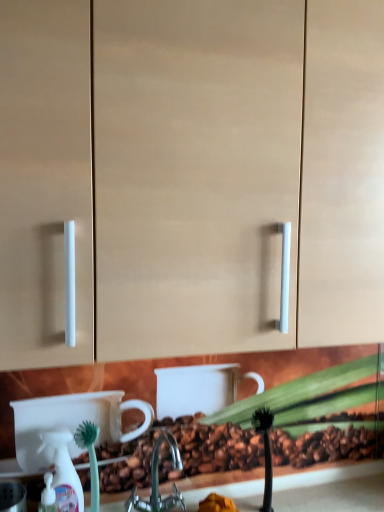
What do you see at coordinates (90, 457) in the screenshot? The width and height of the screenshot is (384, 512). I see `green bristle brush at lower left` at bounding box center [90, 457].

Image resolution: width=384 pixels, height=512 pixels. In order to click on metallic silver faucet at center in this screenshot , I will do `click(158, 480)`.

Identify the location of green bristle brush at lower left. (90, 457).

From the picture: Is green bristle brush at lower left behind white plastic spray bottle at lower left?

Yes, green bristle brush at lower left is further from the camera.

Is green bristle brush at lower left inside or outside of white plastic spray bottle at lower left?

green bristle brush at lower left exists outside the volume of white plastic spray bottle at lower left.

Considering the sizes of green bristle brush at lower left and white plastic spray bottle at lower left in the image, is green bristle brush at lower left wider or thinner than white plastic spray bottle at lower left?

Considering their sizes, green bristle brush at lower left looks broader than white plastic spray bottle at lower left.

From their relative heights in the image, would you say green bristle brush at lower left is taller or shorter than white plastic spray bottle at lower left?

In the image, green bristle brush at lower left appears to be taller than white plastic spray bottle at lower left.

At what (x,y) coordinates should I click in order to perform the action: click on plant on the left of matte beige cabinet at center. Please return your answer as a coordinate pair (x, y). Looking at the image, I should click on (90, 457).

Considering the relative sizes of matte beige cabinet at center and green bristle brush at lower left in the image provided, is matte beige cabinet at center taller than green bristle brush at lower left?

Correct, matte beige cabinet at center is much taller as green bristle brush at lower left.

Based on their positions, is matte beige cabinet at center located to the left or right of green bristle brush at lower left?

matte beige cabinet at center is to the right of green bristle brush at lower left.

In terms of size, does matte beige cabinet at center appear bigger or smaller than green bristle brush at lower left?

Clearly, matte beige cabinet at center is larger in size than green bristle brush at lower left.

Is matte beige cabinet at center positioned with its back to metallic silver faucet at center?

No, metallic silver faucet at center is not at the back of matte beige cabinet at center.

From the image's perspective, is matte beige cabinet at center above or below metallic silver faucet at center?

matte beige cabinet at center is above metallic silver faucet at center.

Can you confirm if matte beige cabinet at center is wider than metallic silver faucet at center?

Indeed, matte beige cabinet at center has a greater width compared to metallic silver faucet at center.

Is green bristle brush at lower left beside metallic silver faucet at center?

No, green bristle brush at lower left is not in contact with metallic silver faucet at center.

Considering the sizes of objects green bristle brush at lower left and metallic silver faucet at center in the image provided, who is taller, green bristle brush at lower left or metallic silver faucet at center?

green bristle brush at lower left.

Is green bristle brush at lower left thinner than metallic silver faucet at center?

Yes, green bristle brush at lower left is thinner than metallic silver faucet at center.

Is green bristle brush at lower left inside or outside of metallic silver faucet at center?

green bristle brush at lower left is not enclosed by metallic silver faucet at center.

In the image, is white plastic spray bottle at lower left positioned in front of or behind matte beige cabinet at center?

white plastic spray bottle at lower left is positioned farther from the viewer than matte beige cabinet at center.

Between white plastic spray bottle at lower left and matte beige cabinet at center, which one appears on the right side from the viewer's perspective?

matte beige cabinet at center is more to the right.

From a real-world perspective, which is physically below, white plastic spray bottle at lower left or matte beige cabinet at center?

In real-world perspective, white plastic spray bottle at lower left is lower.

Considering the sizes of objects white plastic spray bottle at lower left and matte beige cabinet at center in the image provided, who is thinner, white plastic spray bottle at lower left or matte beige cabinet at center?

white plastic spray bottle at lower left is thinner.

From a real-world perspective, relative to metallic silver faucet at center, is white plastic spray bottle at lower left vertically above or below?

From a real-world perspective, white plastic spray bottle at lower left is physically above metallic silver faucet at center.

Is metallic silver faucet at center at the back of white plastic spray bottle at lower left?

No, metallic silver faucet at center is not at the back of white plastic spray bottle at lower left.

Considering the relative sizes of white plastic spray bottle at lower left and metallic silver faucet at center in the image provided, is white plastic spray bottle at lower left bigger than metallic silver faucet at center?

Actually, white plastic spray bottle at lower left might be smaller than metallic silver faucet at center.

From their relative heights in the image, would you say white plastic spray bottle at lower left is taller or shorter than metallic silver faucet at center?

Considering their sizes, white plastic spray bottle at lower left has more height than metallic silver faucet at center.

How many degrees apart are the facing directions of green bristle brush at lower left and matte beige cabinet at center?

1.93 degrees.

Which object is wider, green bristle brush at lower left or matte beige cabinet at center?

matte beige cabinet at center.

Which is more to the right, green bristle brush at lower left or matte beige cabinet at center?

matte beige cabinet at center.

Is green bristle brush at lower left bigger than matte beige cabinet at center?

Incorrect, green bristle brush at lower left is not larger than matte beige cabinet at center.

Where is `soap dispenser positioned vertically above the green bristle brush at lower left (from a real-world perspective)`? The width and height of the screenshot is (384, 512). soap dispenser positioned vertically above the green bristle brush at lower left (from a real-world perspective) is located at coordinates (63, 472).

This screenshot has height=512, width=384. What are the coordinates of `plant behind the matte beige cabinet at center` in the screenshot? It's located at (90, 457).

In the scene shown: Looking at the image, which one is located closer to metallic silver faucet at center, green bristle brush at lower left or matte beige cabinet at center?

green bristle brush at lower left lies closer to metallic silver faucet at center than the other object.

From the image, which object appears to be nearer to metallic silver faucet at center, matte beige cabinet at center or white plastic spray bottle at lower left?

The object closer to metallic silver faucet at center is white plastic spray bottle at lower left.

Estimate the real-world distances between objects in this image. Which object is further from green bristle brush at lower left, white plastic spray bottle at lower left or metallic silver faucet at center?

The object further to green bristle brush at lower left is metallic silver faucet at center.

From the image, which object appears to be nearer to green bristle brush at lower left, white plastic spray bottle at lower left or matte beige cabinet at center?

Based on the image, white plastic spray bottle at lower left appears to be nearer to green bristle brush at lower left.

Considering their positions, is matte beige cabinet at center positioned further to white plastic spray bottle at lower left than green bristle brush at lower left?

The object further to white plastic spray bottle at lower left is matte beige cabinet at center.

Based on their spatial positions, is green bristle brush at lower left or white plastic spray bottle at lower left further from matte beige cabinet at center?

white plastic spray bottle at lower left is positioned further to the anchor matte beige cabinet at center.

Based on their spatial positions, is metallic silver faucet at center or white plastic spray bottle at lower left further from matte beige cabinet at center?

metallic silver faucet at center is positioned further to the anchor matte beige cabinet at center.

Looking at the image, which one is located closer to green bristle brush at lower left, matte beige cabinet at center or metallic silver faucet at center?

metallic silver faucet at center is positioned closer to the anchor green bristle brush at lower left.

Identify the location of soap dispenser between matte beige cabinet at center and metallic silver faucet at center from top to bottom. This screenshot has height=512, width=384. (63, 472).

This screenshot has width=384, height=512. Find the location of `soap dispenser between matte beige cabinet at center and green bristle brush at lower left in the up-down direction`. soap dispenser between matte beige cabinet at center and green bristle brush at lower left in the up-down direction is located at coordinates (63, 472).

In order to click on plant between matte beige cabinet at center and metallic silver faucet at center from top to bottom in this screenshot , I will do pyautogui.click(x=90, y=457).

Locate an element on the screen. plant between white plastic spray bottle at lower left and metallic silver faucet at center is located at coordinates (90, 457).